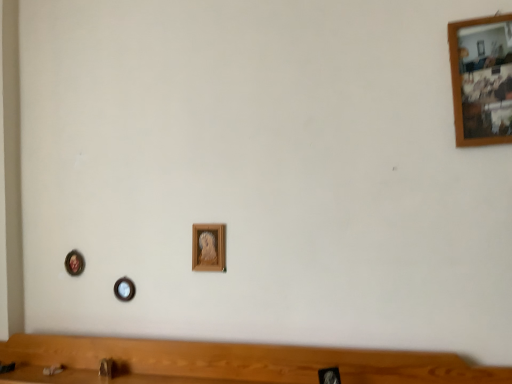
Question: Is point (204, 228) closer or farther from the camera than point (481, 142)?

Choices:
 (A) closer
 (B) farther

Answer: (B)

Question: Is wooden picture frame at center, the 3th picture frame viewed from the left, spatially inside wooden picture frame at upper right, acting as the 1th picture frame starting from the front, or outside of it?

Choices:
 (A) inside
 (B) outside

Answer: (B)

Question: Which of these objects is positioned closest to the metallic circular frame at lower left, the first picture frame positioned from the left?

Choices:
 (A) wooden picture frame at center, which is the second picture frame in right-to-left order
 (B) matte brown faucet at lower center
 (C) wooden picture frame at upper right, the first picture frame when ordered from top to bottom
 (D) wooden picture frame at center, acting as the 2th picture frame starting from the back

Answer: (D)

Question: Based on their relative distances, which object is nearer to the wooden picture frame at upper right, marked as the 4th picture frame in a bottom-to-top arrangement?

Choices:
 (A) wooden picture frame at center, the 3th picture frame viewed from the left
 (B) wooden picture frame at center, the 4th picture frame from the top
 (C) matte brown faucet at lower center
 (D) metallic circular frame at lower left, marked as the 2th picture frame in a bottom-to-top arrangement

Answer: (A)